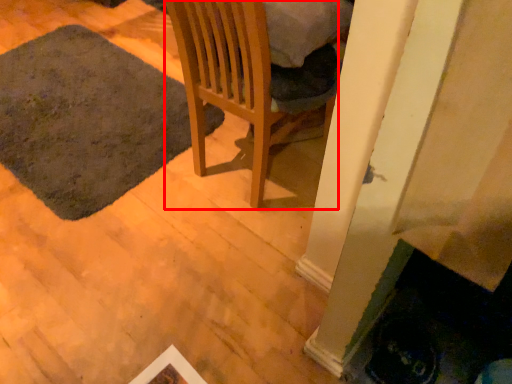
Question: From the image's perspective, considering the relative positions of chair (annotated by the red box) and mat in the image provided, where is chair (annotated by the red box) located with respect to the staircase?

Choices:
 (A) above
 (B) below

Answer: (B)